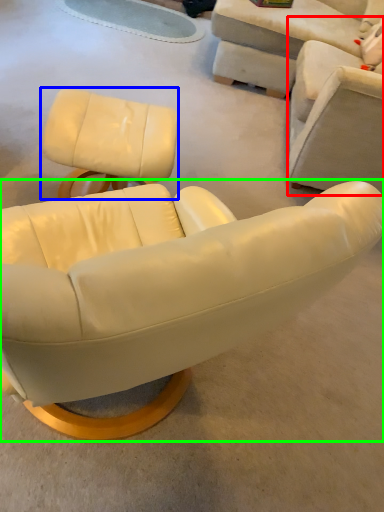
Question: Considering the real-world distances, which object is closest to chair (highlighted by a red box)? chair (highlighted by a blue box) or chair (highlighted by a green box).

Choices:
 (A) chair
 (B) chair

Answer: (A)